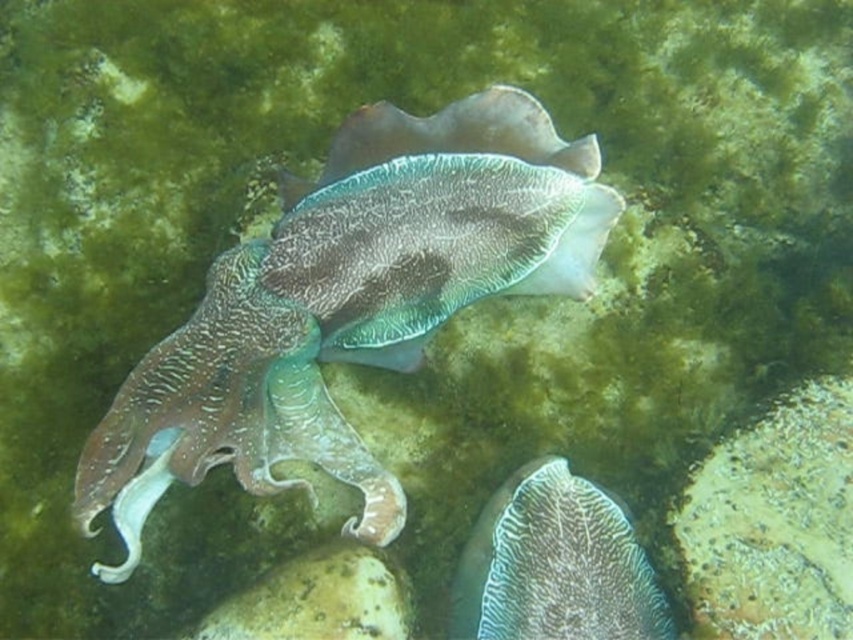
Question: Considering the relative positions of textured brown squid at center and textured white coral at center in the image provided, where is textured brown squid at center located with respect to textured white coral at center?

Choices:
 (A) left
 (B) right

Answer: (A)

Question: Which object appears closest to the camera in this image?

Choices:
 (A) textured white coral at center
 (B) textured brown squid at center

Answer: (B)

Question: Is textured brown squid at center behind textured white coral at center?

Choices:
 (A) no
 (B) yes

Answer: (A)

Question: Does textured brown squid at center appear under textured white coral at center?

Choices:
 (A) yes
 (B) no

Answer: (B)